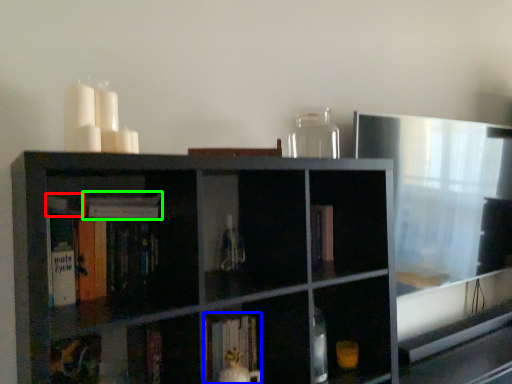
Question: Considering the real-world distances, which object is closest to book (highlighted by a red box)? book (highlighted by a blue box) or book (highlighted by a green box).

Choices:
 (A) book
 (B) book

Answer: (B)